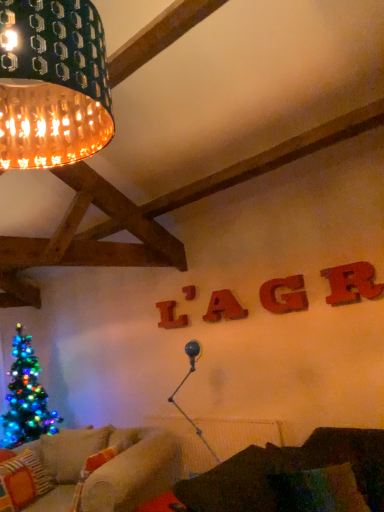
Question: Does wooden letter at upper center, which is counted as the 4th letter, starting from the right, have a greater height compared to knitted wool pillow at lower left?

Choices:
 (A) yes
 (B) no

Answer: (B)

Question: Does wooden letter at upper center, which is counted as the 4th letter, starting from the right, have a lesser height compared to knitted wool pillow at lower left?

Choices:
 (A) yes
 (B) no

Answer: (A)

Question: From the image's perspective, does wooden letter at upper center, which appears as the 2th letter when viewed from the back, appear higher than knitted wool pillow at lower left?

Choices:
 (A) yes
 (B) no

Answer: (A)

Question: Are wooden letter at upper center, which appears as the 2th letter when viewed from the back, and knitted wool pillow at lower left beside each other?

Choices:
 (A) yes
 (B) no

Answer: (B)

Question: Is wooden letter at upper center, which appears as the 2th letter when viewed from the back, turned away from knitted wool pillow at lower left?

Choices:
 (A) no
 (B) yes

Answer: (A)

Question: From the image's perspective, is velvet red letter g at center, arranged as the 2th letter when viewed from the front, positioned above or below knitted wool pillow at lower left?

Choices:
 (A) above
 (B) below

Answer: (A)

Question: Considering their positions, is velvet red letter g at center, which is the fourth letter from back to front, located in front of or behind knitted wool pillow at lower left?

Choices:
 (A) front
 (B) behind

Answer: (B)

Question: Do you think velvet red letter g at center, arranged as the 2th letter when viewed from the front, is within knitted wool pillow at lower left, or outside of it?

Choices:
 (A) inside
 (B) outside

Answer: (B)

Question: In terms of height, does velvet red letter g at center, placed as the second letter when sorted from right to left, look taller or shorter compared to knitted wool pillow at lower left?

Choices:
 (A) tall
 (B) short

Answer: (B)

Question: Is wooden letter at upper center, which appears as the 2th letter when viewed from the back, wider or thinner than velvet red letter g at center, arranged as the 2th letter when viewed from the front?

Choices:
 (A) wide
 (B) thin

Answer: (B)

Question: Considering the positions of wooden letter at upper center, which is counted as the 4th letter, starting from the right, and velvet red letter g at center, placed as the second letter when sorted from right to left, in the image, is wooden letter at upper center, which is counted as the 4th letter, starting from the right, bigger or smaller than velvet red letter g at center, placed as the second letter when sorted from right to left,?

Choices:
 (A) big
 (B) small

Answer: (B)

Question: In the image, is wooden letter at upper center, the second letter from the left, positioned in front of or behind velvet red letter g at center, arranged as the 2th letter when viewed from the front?

Choices:
 (A) behind
 (B) front

Answer: (A)

Question: Considering the positions of wooden letter at upper center, which is counted as the 4th letter, starting from the right, and velvet red letter g at center, positioned as the 4th letter in left-to-right order, in the image, is wooden letter at upper center, which is counted as the 4th letter, starting from the right, taller or shorter than velvet red letter g at center, positioned as the 4th letter in left-to-right order,?

Choices:
 (A) short
 (B) tall

Answer: (A)

Question: Based on their sizes in the image, would you say velvet red letter g at center, positioned as the 4th letter in left-to-right order, is bigger or smaller than wooden letter at center, the 1th letter viewed from the back?

Choices:
 (A) big
 (B) small

Answer: (A)

Question: Considering the positions of velvet red letter g at center, arranged as the 2th letter when viewed from the front, and wooden letter at center, which appears as the fifth letter when viewed from the right, in the image, is velvet red letter g at center, arranged as the 2th letter when viewed from the front, taller or shorter than wooden letter at center, which appears as the fifth letter when viewed from the right,?

Choices:
 (A) tall
 (B) short

Answer: (B)